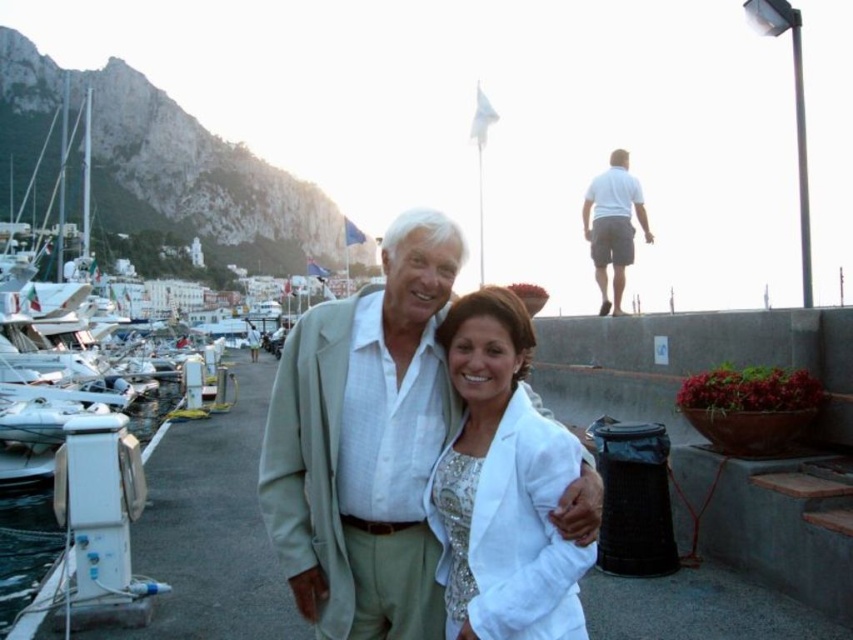
You are a photographer standing at the edge of the marina. You want to take a photo of the white satin blazer at center and the white cotton shirt at upper right. The minimum distance required for your camera to focus on both objects clearly is 60 feet. Do you think your camera can focus on both objects clearly?

The distance between the white satin blazer at center and the white cotton shirt at upper right is 55.05 feet, which is less than the camera requirement of 60 feet. Therefore, the camera can focus on both objects clearly.

You are a photographer at the marina and want to capture the white satin blazer at center and the white cotton shirt at upper right in the same frame. Which piece of clothing is narrower when viewed from the photographer position?

The white satin blazer at center is thinner than the white cotton shirt at upper right, so the white satin blazer at center is narrower when viewed from the photographer position.